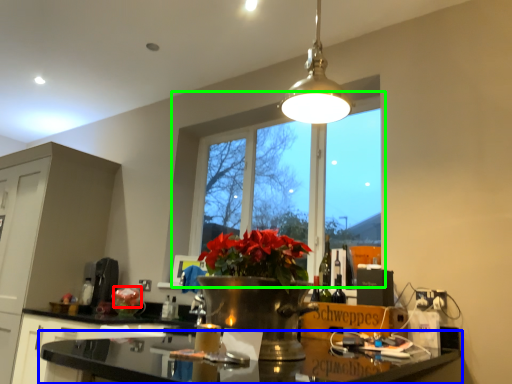
Question: Estimate the real-world distances between objects in this image. Which object is farther from flower (highlighted by a red box), countertop (highlighted by a blue box) or window (highlighted by a green box)?

Choices:
 (A) countertop
 (B) window

Answer: (B)